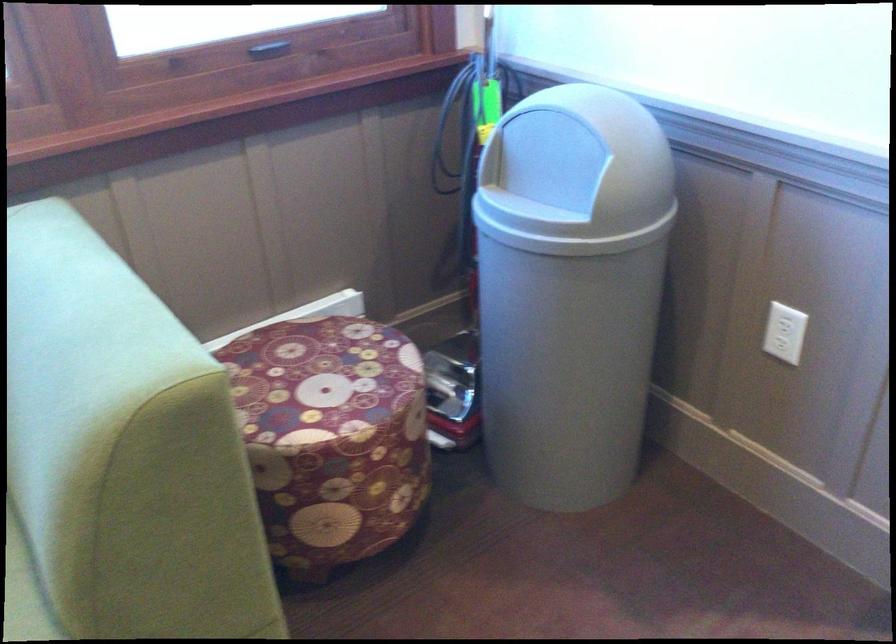
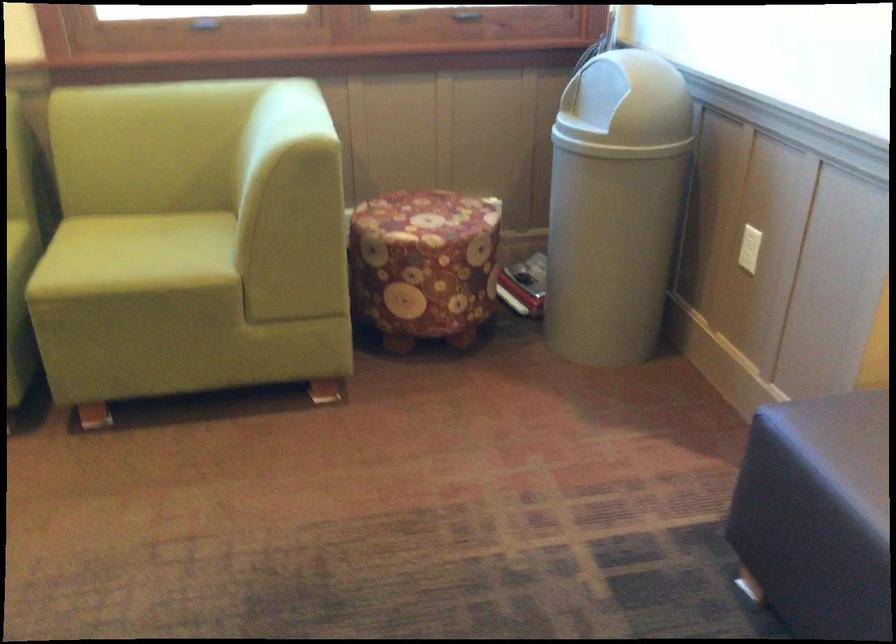
In the second image, find the point that corresponds to the point at 289,366 in the first image.

(414, 207)